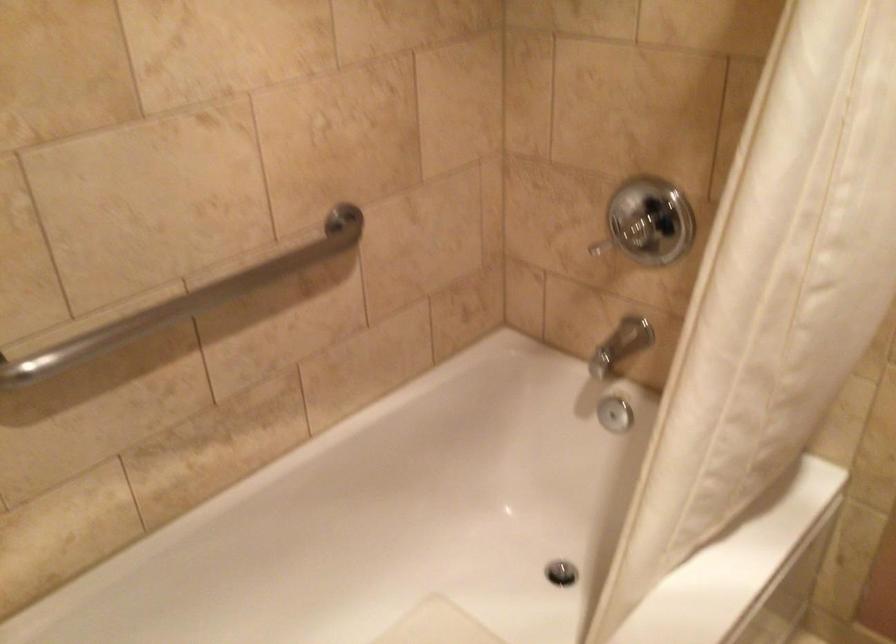
This screenshot has width=896, height=644. What do you see at coordinates (642, 227) in the screenshot? I see `a shower control handle` at bounding box center [642, 227].